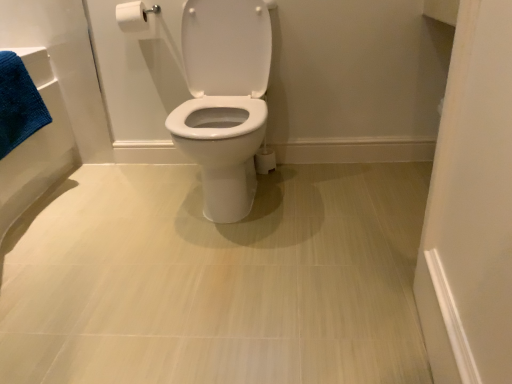
Question: Would you say white glossy toilet at center is a long distance from blue cotton bath towel at left?

Choices:
 (A) yes
 (B) no

Answer: (B)

Question: Can we say white glossy toilet at center lies outside blue cotton bath towel at left?

Choices:
 (A) no
 (B) yes

Answer: (B)

Question: Does white glossy toilet at center come in front of blue cotton bath towel at left?

Choices:
 (A) yes
 (B) no

Answer: (A)

Question: Is white glossy toilet at center smaller than blue cotton bath towel at left?

Choices:
 (A) yes
 (B) no

Answer: (B)

Question: Can you confirm if white glossy toilet at center is positioned to the right of blue cotton bath towel at left?

Choices:
 (A) no
 (B) yes

Answer: (B)

Question: Considering the positions of point (356, 193) and point (150, 8), is point (356, 193) closer or farther from the camera than point (150, 8)?

Choices:
 (A) farther
 (B) closer

Answer: (B)

Question: Would you say white glossy toilet at center is to the left or to the right of white matte toilet paper at upper left in the picture?

Choices:
 (A) right
 (B) left

Answer: (A)

Question: Considering the positions of white glossy toilet at center and white matte toilet paper at upper left in the image, is white glossy toilet at center bigger or smaller than white matte toilet paper at upper left?

Choices:
 (A) small
 (B) big

Answer: (B)

Question: Relative to white matte toilet paper at upper left, is white glossy toilet at center in front or behind?

Choices:
 (A) front
 (B) behind

Answer: (A)

Question: Is blue cotton bath towel at left wider or thinner than white matte toilet paper at upper left?

Choices:
 (A) thin
 (B) wide

Answer: (B)

Question: Is blue cotton bath towel at left spatially inside white matte toilet paper at upper left, or outside of it?

Choices:
 (A) outside
 (B) inside

Answer: (A)

Question: Is blue cotton bath towel at left taller or shorter than white matte toilet paper at upper left?

Choices:
 (A) tall
 (B) short

Answer: (A)

Question: From a real-world perspective, is blue cotton bath towel at left positioned above or below white matte toilet paper at upper left?

Choices:
 (A) below
 (B) above

Answer: (A)

Question: Considering the relative positions of white matte toilet paper at upper left and white glossy toilet at center in the image provided, is white matte toilet paper at upper left to the left or to the right of white glossy toilet at center?

Choices:
 (A) left
 (B) right

Answer: (A)

Question: From a real-world perspective, is white matte toilet paper at upper left physically located above or below white glossy toilet at center?

Choices:
 (A) below
 (B) above

Answer: (B)